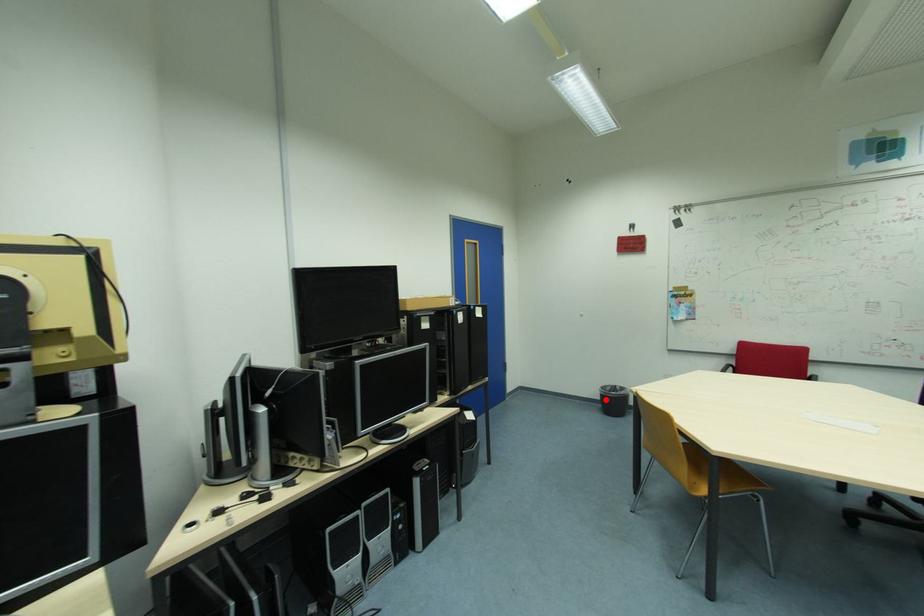
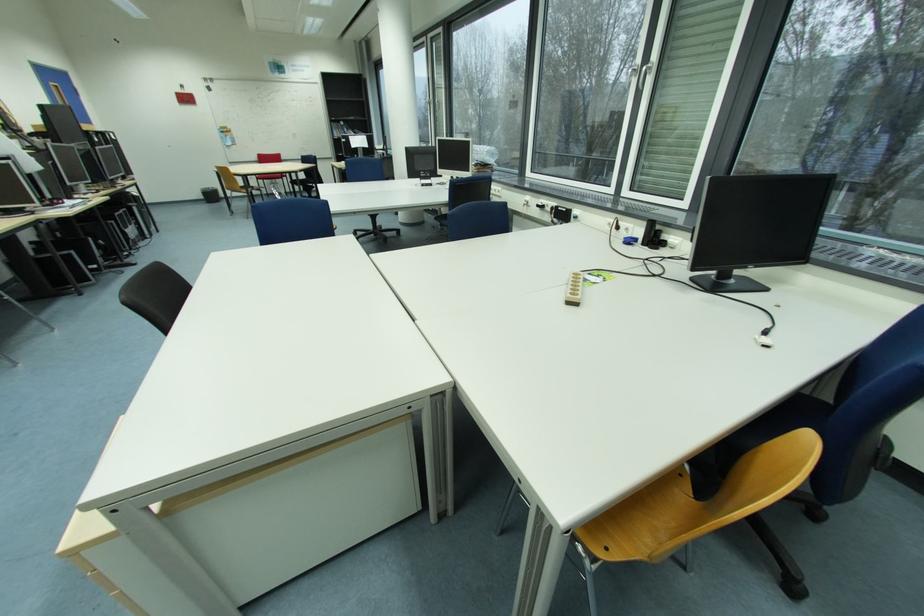
Question: I am providing you with two images of the same scene from different viewpoints. Image1 has a red point marked. In image2, the corresponding 3D location appears at what relative position? Reply with the corresponding letter.

Choices:
 (A) Closer
 (B) Farther

Answer: (A)